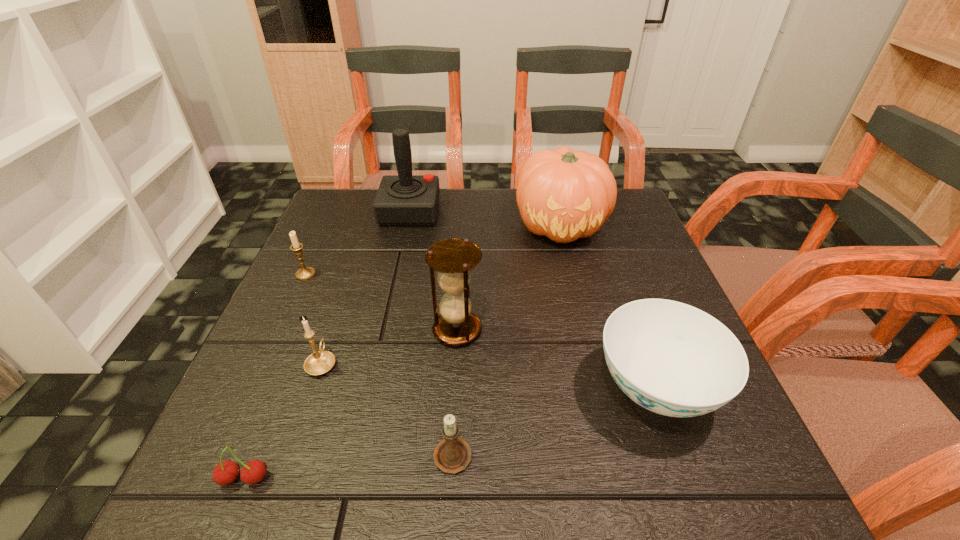
Where is `joystick that is at the far edge`? The height and width of the screenshot is (540, 960). joystick that is at the far edge is located at coordinates point(402,200).

Locate an element on the screen. pumpkin located in the far edge section of the desktop is located at coordinates (564, 195).

The width and height of the screenshot is (960, 540). I want to click on candle holder that is at the near edge, so click(452, 455).

Identify the location of cherry that is at the near edge. This screenshot has height=540, width=960. point(226,472).

Locate an element on the screen. joystick at the left edge is located at coordinates (402, 200).

Where is `cherry that is at the left edge`? Image resolution: width=960 pixels, height=540 pixels. cherry that is at the left edge is located at coordinates (226, 472).

The width and height of the screenshot is (960, 540). I want to click on pumpkin present at the right edge, so [x=564, y=195].

Where is `chinaware present at the right edge`? chinaware present at the right edge is located at coordinates (671, 358).

Find the location of a particular element. This screenshot has height=540, width=960. object at the far left corner is located at coordinates (402, 200).

Find the location of a particular element. The image size is (960, 540). object that is at the near left corner is located at coordinates (226, 472).